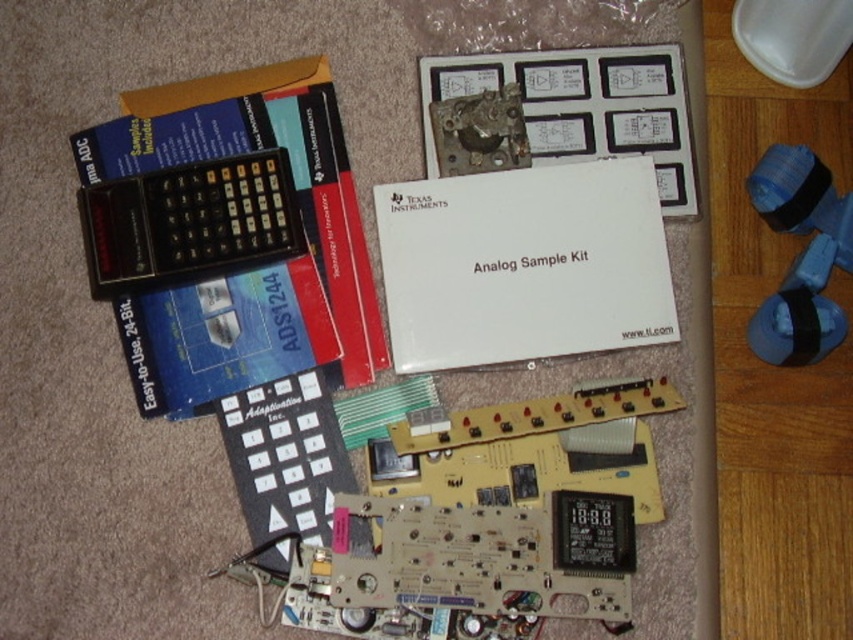
Question: Among these objects, which one is farthest from the camera?

Choices:
 (A) metallic silver circuit board at upper center
 (B) black plastic calculator at upper left

Answer: (A)

Question: Which point is closer to the camera?

Choices:
 (A) (297, 419)
 (B) (296, 198)
 (C) (642, 52)

Answer: (A)

Question: Is metallic silver circuit board at upper center to the right of black plastic calculator at upper left from the viewer's perspective?

Choices:
 (A) yes
 (B) no

Answer: (A)

Question: Which object is closer to the camera taking this photo?

Choices:
 (A) black plastic remote at center
 (B) black plastic calculator at upper left
 (C) black paper at upper left

Answer: (A)

Question: Is metallic silver circuit board at upper center wider than black plastic remote at center?

Choices:
 (A) no
 (B) yes

Answer: (B)

Question: Is black plastic calculator at upper left bigger than black plastic remote at center?

Choices:
 (A) no
 (B) yes

Answer: (A)